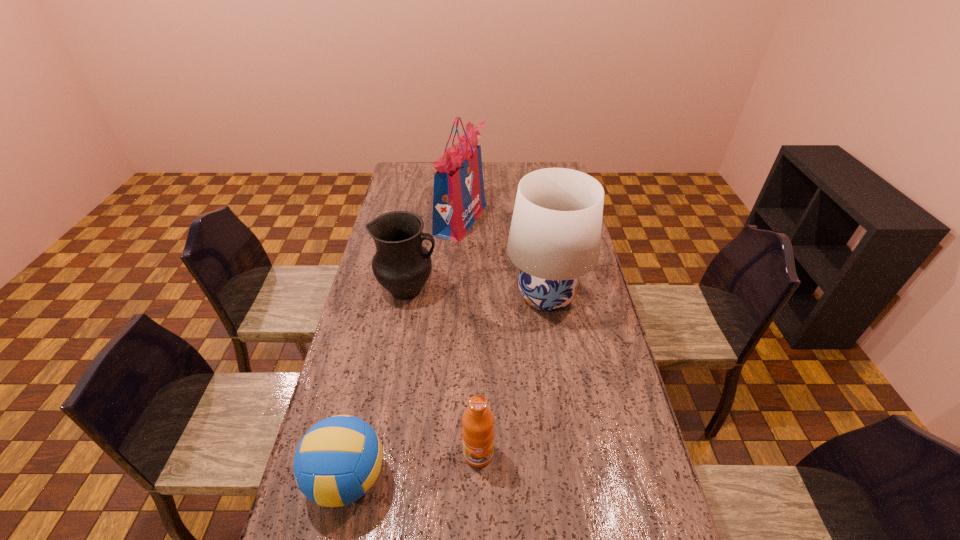
This screenshot has height=540, width=960. What are the coordinates of `grocery bag` in the screenshot? It's located at (x=458, y=199).

You are a GUI agent. You are given a task and a screenshot of the screen. Output one action in this format:
    pyautogui.click(x=<x>, y=<y>)
    Task: Click on the rightmost object
    
    Given the screenshot: What is the action you would take?
    pyautogui.click(x=555, y=234)

This screenshot has width=960, height=540. Identify the location of pitcher. (402, 265).

Identify the location of fruit juice. The width and height of the screenshot is (960, 540). (478, 432).

Find the location of a particular element. volleyball is located at coordinates (338, 460).

I want to click on vacant space located on the front-facing side of the farthest object, so click(575, 220).

I want to click on vacant area situated on the front-facing side of the lampshade, so click(x=419, y=296).

This screenshot has height=540, width=960. Find the location of `vacant space located on the front-facing side of the lampshade`. vacant space located on the front-facing side of the lampshade is located at coordinates [396, 296].

I want to click on vacant region located on the front-facing side of the lampshade, so click(x=455, y=296).

Locate an element on the screen. The width and height of the screenshot is (960, 540). vacant space located 0.300m on the handle side of the third shortest object is located at coordinates (520, 289).